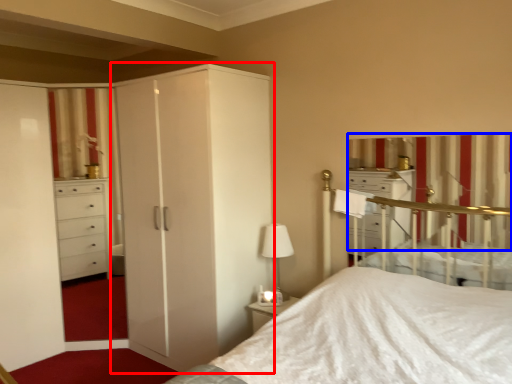
Question: Among these objects, which one is farthest to the camera, cupboard (highlighted by a red box) or curtain (highlighted by a blue box)?

Choices:
 (A) cupboard
 (B) curtain

Answer: (A)